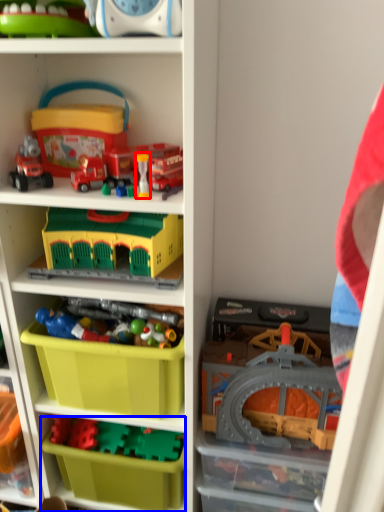
Question: Among these objects, which one is nearest to the camera, toy (highlighted by a red box) or storage box (highlighted by a blue box)?

Choices:
 (A) toy
 (B) storage box

Answer: (A)